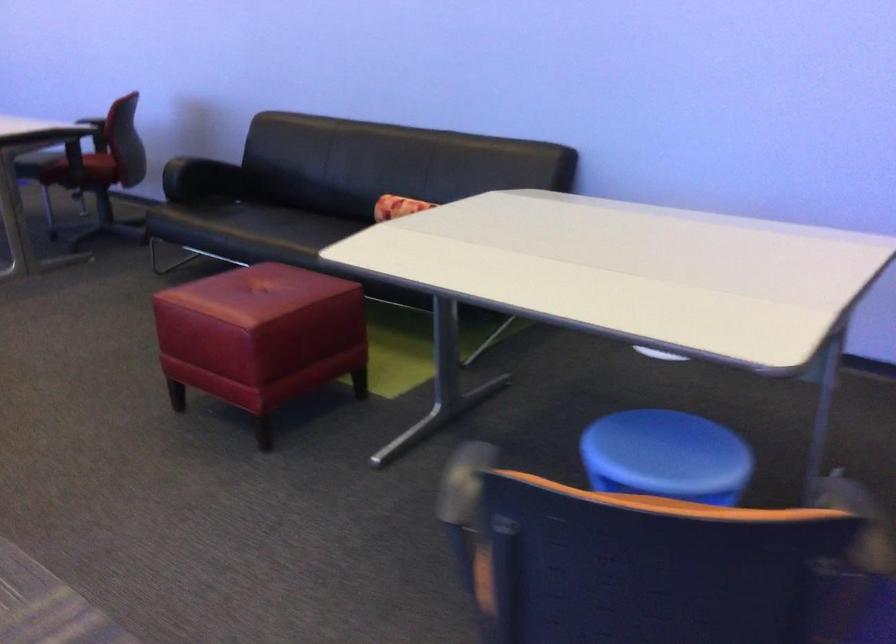
Where would you sit the sofa sitting surface? Please return your answer as a coordinate pair (x, y).

(312, 198)